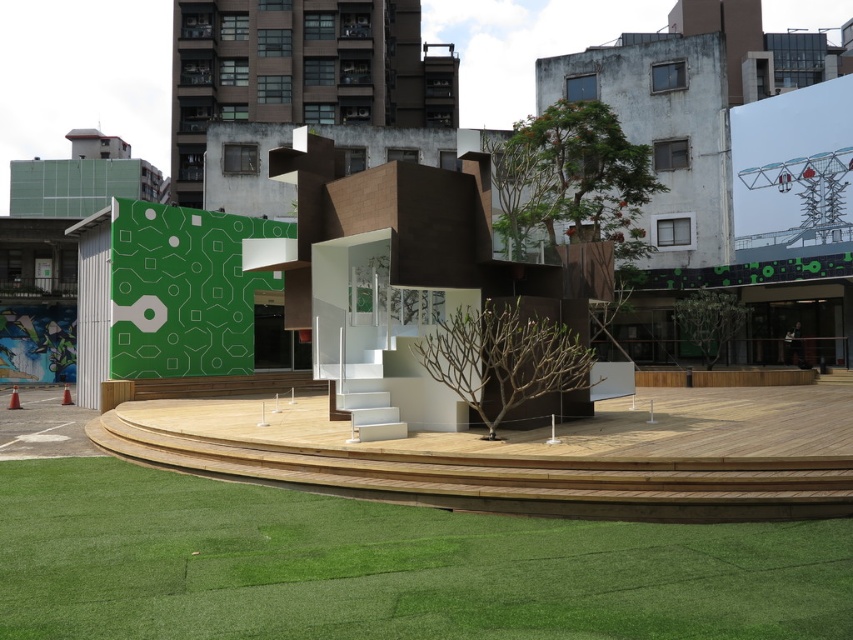
Question: Does green artificial turf at lower center have a lesser width compared to green matte wall at upper left?

Choices:
 (A) yes
 (B) no

Answer: (A)

Question: Which point is farther to the camera?

Choices:
 (A) green artificial turf at lower center
 (B) green matte wall at upper left

Answer: (B)

Question: Does green artificial turf at lower center appear over green matte wall at upper left?

Choices:
 (A) no
 (B) yes

Answer: (A)

Question: Does green artificial turf at lower center come in front of green matte wall at upper left?

Choices:
 (A) yes
 (B) no

Answer: (A)

Question: Which object is closer to the camera taking this photo?

Choices:
 (A) green matte wall at upper left
 (B) green artificial turf at lower center

Answer: (B)